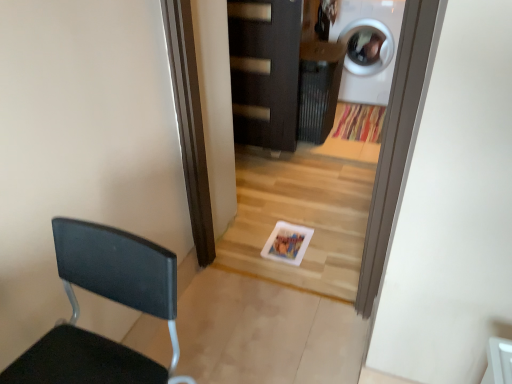
Question: From a real-world perspective, is black matte chair at left on dark wood door at center?

Choices:
 (A) yes
 (B) no

Answer: (A)

Question: Is black matte chair at left located outside dark wood door at center?

Choices:
 (A) no
 (B) yes

Answer: (B)

Question: Can you confirm if black matte chair at left is smaller than dark wood door at center?

Choices:
 (A) no
 (B) yes

Answer: (A)

Question: Is black matte chair at left positioned before dark wood door at center?

Choices:
 (A) yes
 (B) no

Answer: (A)

Question: From the image's perspective, is black matte chair at left under dark wood door at center?

Choices:
 (A) yes
 (B) no

Answer: (A)

Question: From the image's perspective, is black matte chair at left positioned above or below white glossy washing machine at upper right?

Choices:
 (A) below
 (B) above

Answer: (A)

Question: Based on their sizes in the image, would you say black matte chair at left is bigger or smaller than white glossy washing machine at upper right?

Choices:
 (A) small
 (B) big

Answer: (A)

Question: Visually, is black matte chair at left positioned to the left or to the right of white glossy washing machine at upper right?

Choices:
 (A) left
 (B) right

Answer: (A)

Question: In the image, is black matte chair at left positioned in front of or behind white glossy washing machine at upper right?

Choices:
 (A) front
 (B) behind

Answer: (A)

Question: From a real-world perspective, is black matte chair at left above or below dark wood door at center?

Choices:
 (A) above
 (B) below

Answer: (A)

Question: Looking at their shapes, would you say black matte chair at left is wider or thinner than dark wood door at center?

Choices:
 (A) wide
 (B) thin

Answer: (A)

Question: Is black matte chair at left situated inside dark wood door at center or outside?

Choices:
 (A) inside
 (B) outside

Answer: (B)

Question: Is black matte chair at left bigger or smaller than dark wood door at center?

Choices:
 (A) small
 (B) big

Answer: (B)

Question: Is white glossy washing machine at upper right in front of or behind black matte chair at left in the image?

Choices:
 (A) front
 (B) behind

Answer: (B)

Question: In terms of width, does white glossy washing machine at upper right look wider or thinner when compared to black matte chair at left?

Choices:
 (A) thin
 (B) wide

Answer: (B)